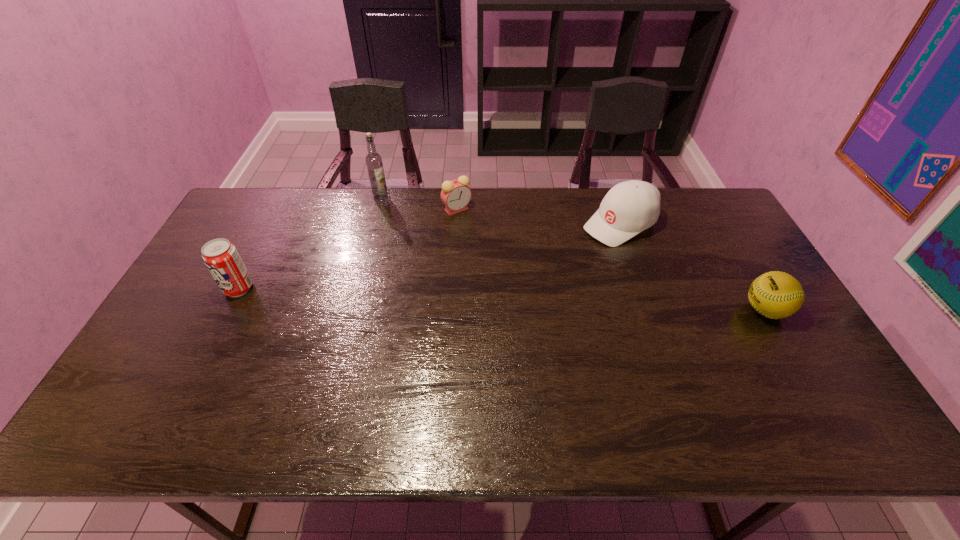
Locate an element on the screen. This screenshot has height=540, width=960. the leftmost object is located at coordinates (221, 257).

The height and width of the screenshot is (540, 960). What are the coordinates of `softball` in the screenshot? It's located at (775, 294).

Locate an element on the screen. The image size is (960, 540). vodka is located at coordinates (374, 164).

At what (x,y) coordinates should I click in order to perform the action: click on the fourth object from right to left. Please return your answer as a coordinate pair (x, y). This screenshot has width=960, height=540. Looking at the image, I should click on (374, 164).

This screenshot has height=540, width=960. I want to click on alarm clock, so click(455, 194).

Find the location of a particular element. the fourth object from left to right is located at coordinates (630, 207).

Identify the location of free point located on the right of the soda can. point(288,288).

At what (x,y) coordinates should I click in order to perform the action: click on free space located on the logo side of the softball. Please return your answer as a coordinate pair (x, y). This screenshot has width=960, height=540. Looking at the image, I should click on (631, 310).

At what (x,y) coordinates should I click in order to perform the action: click on vacant space located on the logo side of the softball. Please return your answer as a coordinate pair (x, y). Looking at the image, I should click on (717, 310).

In order to click on vacant area located 0.220m on the logo side of the softball in this screenshot , I will do `click(663, 310)`.